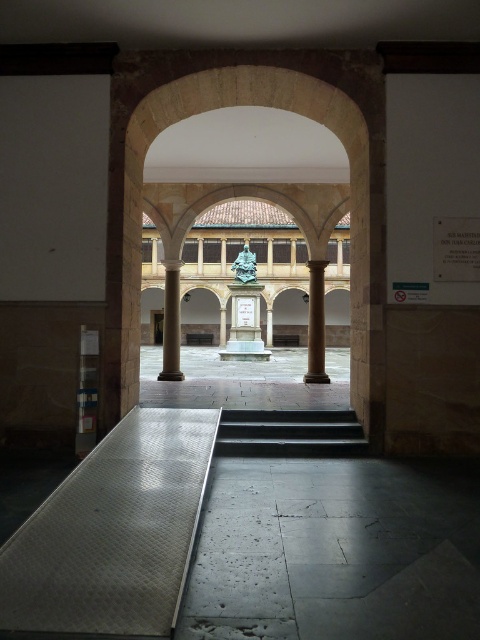
Does brown polished stone column at center have a greater height compared to smooth stone column at center?

No, brown polished stone column at center is not taller than smooth stone column at center.

Who is more distant from viewer, (310, 300) or (171, 317)?

The point (310, 300) is behind.

Where is `brown polished stone column at center`? brown polished stone column at center is located at coordinates (315, 324).

At what (x,y) coordinates should I click in order to perform the action: click on brown polished stone column at center. Please return your answer as a coordinate pair (x, y). This screenshot has width=480, height=640. Looking at the image, I should click on (315, 324).

Does silver textured ramp at lower left lie in front of black polished stone stairs at center?

Yes, it is in front of black polished stone stairs at center.

Which is behind, point (103, 493) or point (216, 444)?

The point (216, 444) is more distant.

Between point (35, 627) and point (312, 410), which one is positioned behind?

The point (312, 410) is behind.

This screenshot has height=640, width=480. Identify the location of silver textured ramp at lower left. (113, 532).

Is point (71, 516) closer to viewer compared to point (172, 285)?

That is True.

Consider the image. Does silver textured ramp at lower left come in front of smooth stone column at center?

Yes, it is in front of smooth stone column at center.

Between point (153, 456) and point (169, 364), which one is positioned behind?

The point (169, 364) is behind.

The image size is (480, 640). I want to click on silver textured ramp at lower left, so click(113, 532).